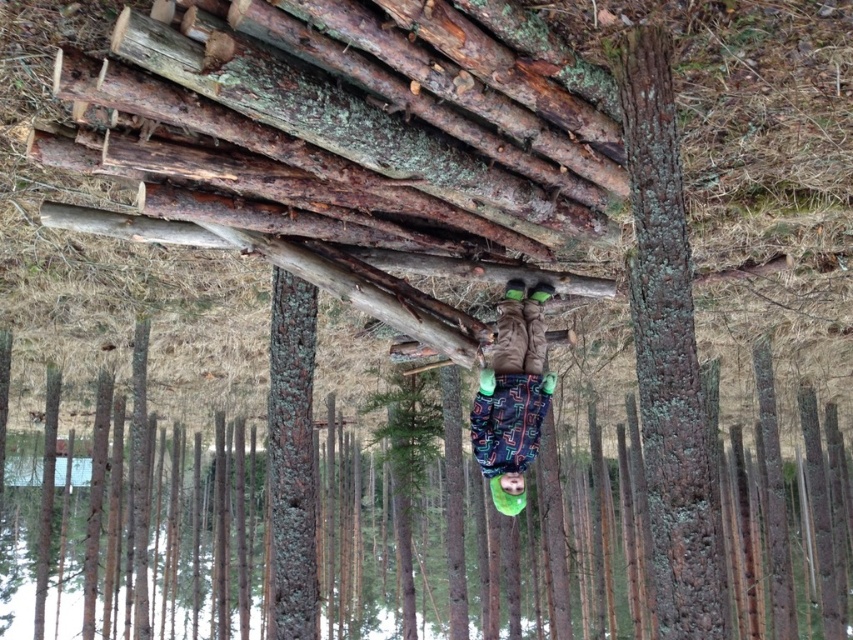
Between dark brown rough bark at center and dark brown fabric snowboard at center, which one appears on the right side from the viewer's perspective?

dark brown rough bark at center

Is dark brown rough bark at center smaller than dark brown fabric snowboard at center?

Correct, dark brown rough bark at center occupies less space than dark brown fabric snowboard at center.

Which is in front, point (694, 518) or point (485, 410)?

Point (694, 518) is more forward.

Image resolution: width=853 pixels, height=640 pixels. I want to click on dark brown rough bark at center, so click(666, 348).

Between point (677, 218) and point (401, 396), which one is positioned behind?

The point (401, 396) is behind.

Who is higher up, dark brown rough bark at center or green matte tree at center?

Positioned higher is dark brown rough bark at center.

The width and height of the screenshot is (853, 640). In order to click on dark brown rough bark at center in this screenshot , I will do `click(666, 348)`.

Does dark brown rough bark at center appear on the left side of green mossy bark at center?

No, dark brown rough bark at center is not to the left of green mossy bark at center.

Where is `dark brown rough bark at center`? The image size is (853, 640). dark brown rough bark at center is located at coordinates (666, 348).

Locate an element on the screen. The height and width of the screenshot is (640, 853). dark brown rough bark at center is located at coordinates (666, 348).